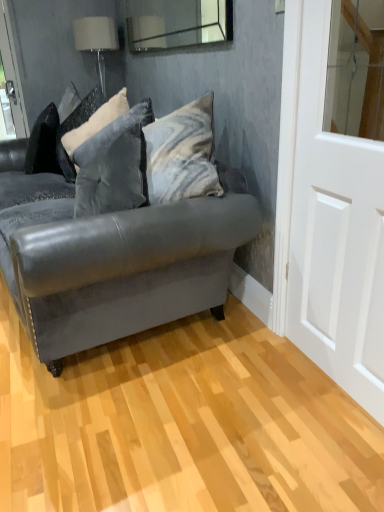
Question: Is the depth of white glossy door at right greater than that of clear glass mirror at upper center?

Choices:
 (A) yes
 (B) no

Answer: (B)

Question: Are white glossy door at right and clear glass mirror at upper center located far from each other?

Choices:
 (A) no
 (B) yes

Answer: (B)

Question: From the image's perspective, is white glossy door at right beneath clear glass mirror at upper center?

Choices:
 (A) no
 (B) yes

Answer: (B)

Question: Is white glossy door at right placed right next to clear glass mirror at upper center?

Choices:
 (A) no
 (B) yes

Answer: (A)

Question: Is clear glass mirror at upper center completely or partially inside white glossy door at right?

Choices:
 (A) no
 (B) yes

Answer: (A)

Question: Is clear glass mirror at upper center taller or shorter than white glossy door at right?

Choices:
 (A) short
 (B) tall

Answer: (A)

Question: Based on their positions, is clear glass mirror at upper center located to the left or right of white glossy door at right?

Choices:
 (A) left
 (B) right

Answer: (A)

Question: From a real-world perspective, relative to white glossy door at right, is clear glass mirror at upper center vertically above or below?

Choices:
 (A) below
 (B) above

Answer: (B)

Question: From the image's perspective, is clear glass mirror at upper center located above or below white glossy door at right?

Choices:
 (A) above
 (B) below

Answer: (A)

Question: Is velvet gray pillow at center, placed as the first pillow when sorted from front to back, situated inside white fabric lampshade at upper left or outside?

Choices:
 (A) outside
 (B) inside

Answer: (A)

Question: Considering their positions, is velvet gray pillow at center, placed as the 2th pillow when sorted from back to front, located in front of or behind white fabric lampshade at upper left?

Choices:
 (A) behind
 (B) front

Answer: (B)

Question: Based on their sizes in the image, would you say velvet gray pillow at center, placed as the 2th pillow when sorted from back to front, is bigger or smaller than white fabric lampshade at upper left?

Choices:
 (A) small
 (B) big

Answer: (B)

Question: From a real-world perspective, is velvet gray pillow at center, placed as the first pillow when sorted from front to back, above or below white fabric lampshade at upper left?

Choices:
 (A) above
 (B) below

Answer: (B)

Question: Do you think velvet gray pillow at center, placed as the first pillow when sorted from front to back, is within clear glass mirror at upper center, or outside of it?

Choices:
 (A) outside
 (B) inside

Answer: (A)

Question: In the image, is velvet gray pillow at center, placed as the 2th pillow when sorted from back to front, positioned in front of or behind clear glass mirror at upper center?

Choices:
 (A) behind
 (B) front

Answer: (A)